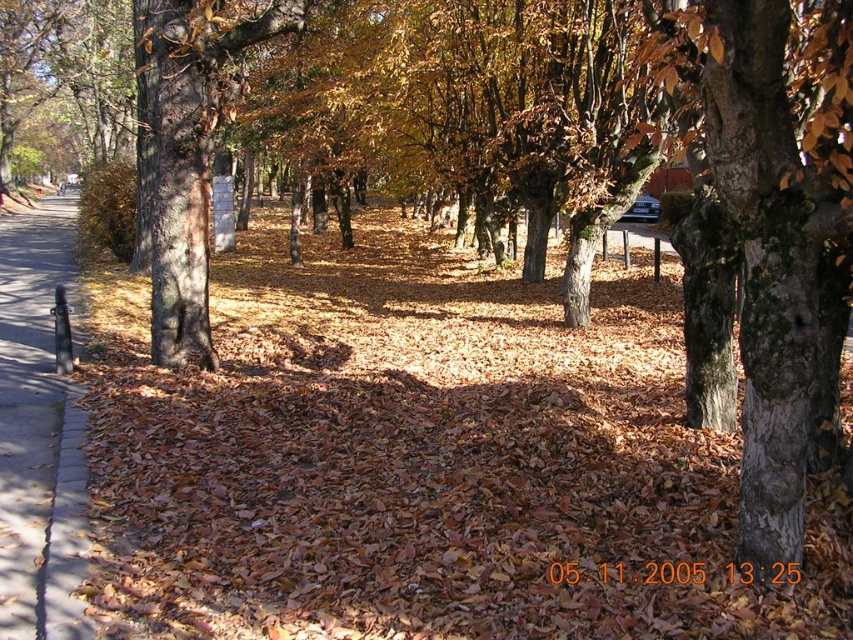
Question: Can you confirm if concrete sidewalk at left is positioned below brown rough bark tree at left?

Choices:
 (A) yes
 (B) no

Answer: (A)

Question: Can you confirm if concrete sidewalk at left is wider than brown rough bark tree at left?

Choices:
 (A) yes
 (B) no

Answer: (A)

Question: Which object appears closest to the camera in this image?

Choices:
 (A) brown rough bark tree at left
 (B) concrete sidewalk at left

Answer: (B)

Question: Which object is closer to the camera taking this photo?

Choices:
 (A) concrete sidewalk at left
 (B) brown rough bark tree at left

Answer: (A)

Question: Can you confirm if concrete sidewalk at left is thinner than brown rough bark tree at left?

Choices:
 (A) no
 (B) yes

Answer: (A)